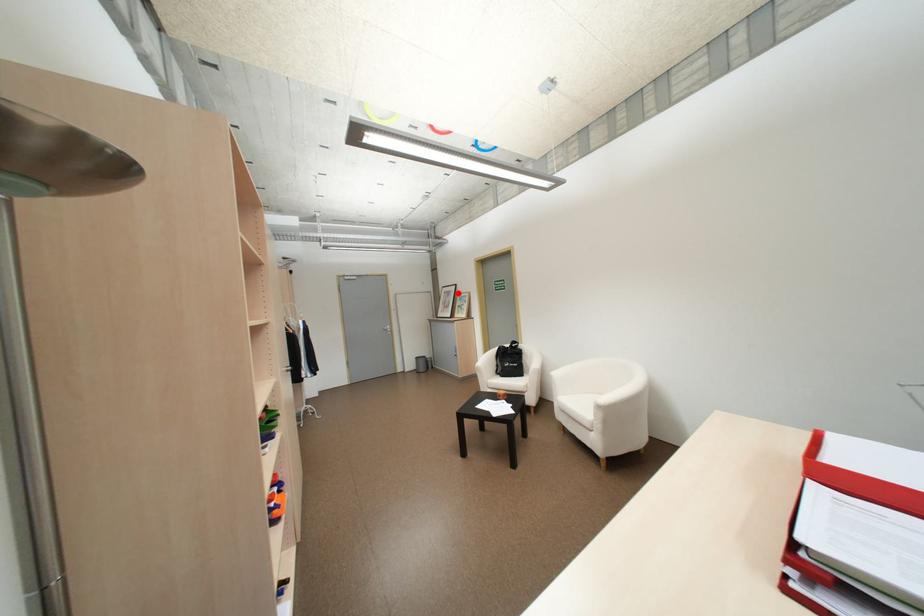
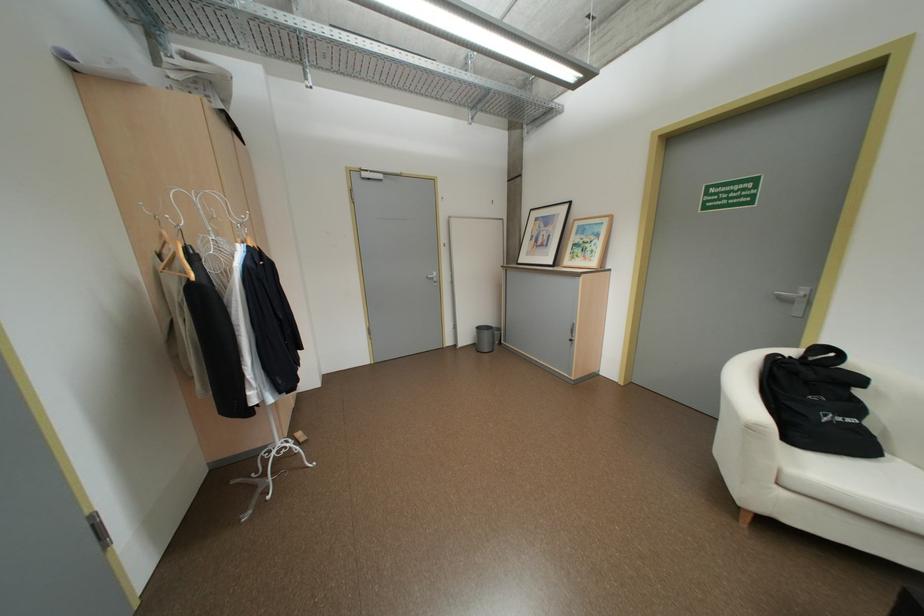
Question: A red point is marked in image1. In image2, is the corresponding 3D point closer to the camera or farther? Reply with the corresponding letter.

Choices:
 (A) The corresponding 3D point is closer.
 (B) The corresponding 3D point is farther.

Answer: (A)